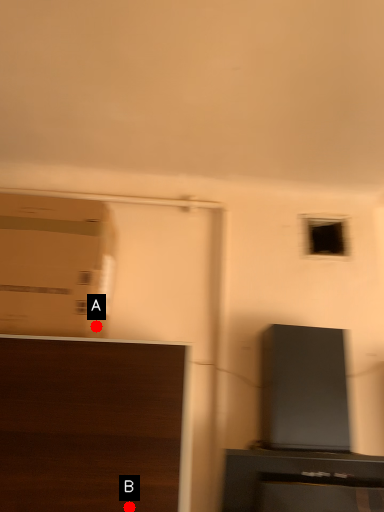
Question: Two points are circled on the image, labeled by A and B beside each circle. Among these points, which one is farthest from the camera?

Choices:
 (A) A is further
 (B) B is further

Answer: (A)